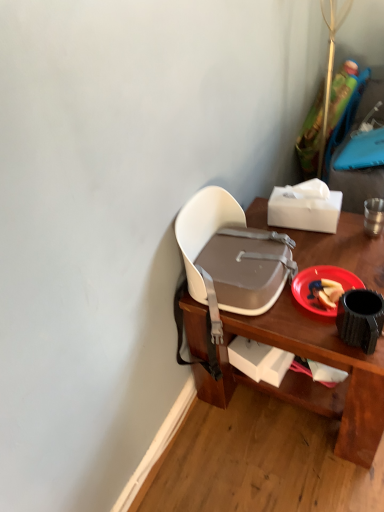
Question: From the image's perspective, is white matte box at lower center, which ranks as the second box in top-to-bottom order, under red plastic plate at lower right?

Choices:
 (A) no
 (B) yes

Answer: (B)

Question: From a real-world perspective, is white matte box at lower center, which ranks as the second box in top-to-bottom order, positioned over red plastic plate at lower right based on gravity?

Choices:
 (A) yes
 (B) no

Answer: (B)

Question: Is white matte box at lower center, which ranks as the second box in top-to-bottom order, turned away from red plastic plate at lower right?

Choices:
 (A) yes
 (B) no

Answer: (B)

Question: Considering the relative positions of white matte box at lower center, which ranks as the 1th box in bottom-to-top order, and red plastic plate at lower right in the image provided, is white matte box at lower center, which ranks as the 1th box in bottom-to-top order, to the right of red plastic plate at lower right from the viewer's perspective?

Choices:
 (A) no
 (B) yes

Answer: (A)

Question: Does white matte box at lower center, which ranks as the second box in top-to-bottom order, have a larger size compared to red plastic plate at lower right?

Choices:
 (A) yes
 (B) no

Answer: (A)

Question: Is white matte box at lower center, which ranks as the 1th box in bottom-to-top order, to the left or to the right of white plastic chair at upper center in the image?

Choices:
 (A) right
 (B) left

Answer: (B)

Question: From the image's perspective, is white matte box at lower center, which ranks as the 1th box in bottom-to-top order, above or below white plastic chair at upper center?

Choices:
 (A) above
 (B) below

Answer: (B)

Question: Based on their sizes in the image, would you say white matte box at lower center, which ranks as the 1th box in bottom-to-top order, is bigger or smaller than white plastic chair at upper center?

Choices:
 (A) big
 (B) small

Answer: (B)

Question: From a real-world perspective, relative to white plastic chair at upper center, is white matte box at lower center, which ranks as the 1th box in bottom-to-top order, vertically above or below?

Choices:
 (A) below
 (B) above

Answer: (A)

Question: Based on their positions, is white matte box at lower center, which ranks as the 1th box in bottom-to-top order, located to the left or right of white plastic chair at center?

Choices:
 (A) right
 (B) left

Answer: (A)

Question: From the image's perspective, is white matte box at lower center, which ranks as the second box in top-to-bottom order, above or below white plastic chair at center?

Choices:
 (A) above
 (B) below

Answer: (B)

Question: Considering the positions of white matte box at lower center, which ranks as the second box in top-to-bottom order, and white plastic chair at center in the image, is white matte box at lower center, which ranks as the second box in top-to-bottom order, wider or thinner than white plastic chair at center?

Choices:
 (A) thin
 (B) wide

Answer: (A)

Question: Considering the positions of point (240, 354) and point (225, 227), is point (240, 354) closer or farther from the camera than point (225, 227)?

Choices:
 (A) closer
 (B) farther

Answer: (A)

Question: Would you say white plastic chair at upper center is to the left or to the right of white matte tissue box at upper right, the second box in the bottom-to-top sequence, in the picture?

Choices:
 (A) right
 (B) left

Answer: (A)

Question: In terms of size, does white plastic chair at upper center appear bigger or smaller than white matte tissue box at upper right, the second box in the bottom-to-top sequence?

Choices:
 (A) big
 (B) small

Answer: (A)